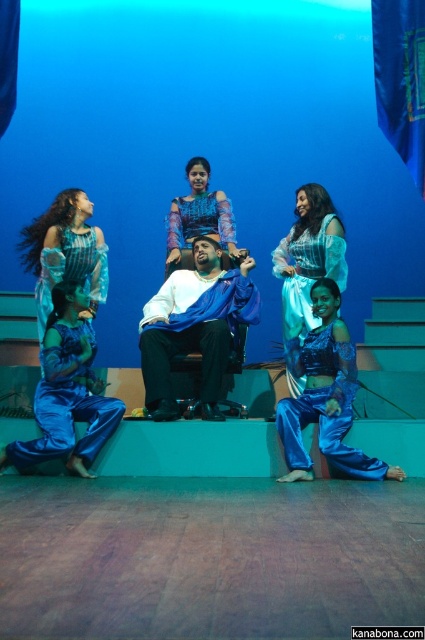
Question: Among these points, which one is farthest from the camera?

Choices:
 (A) (184, 321)
 (B) (353, 392)

Answer: (A)

Question: Is blue satin pants at lower left above shiny blue dress at center?

Choices:
 (A) yes
 (B) no

Answer: (B)

Question: Which object is closer to the camera taking this photo?

Choices:
 (A) blue satin pants at lower left
 (B) shiny blue fabric at lower right

Answer: (B)

Question: Does blue fabric draped at center have a smaller size compared to shiny blue dress at center?

Choices:
 (A) yes
 (B) no

Answer: (B)

Question: Among these points, which one is nearest to the camera?

Choices:
 (A) coord(186,224)
 (B) coord(147,369)
 (C) coord(50,436)
 (D) coord(312,204)

Answer: (C)

Question: Is blue fabric draped at center to the right of matte blue dress at center from the viewer's perspective?

Choices:
 (A) no
 (B) yes

Answer: (A)